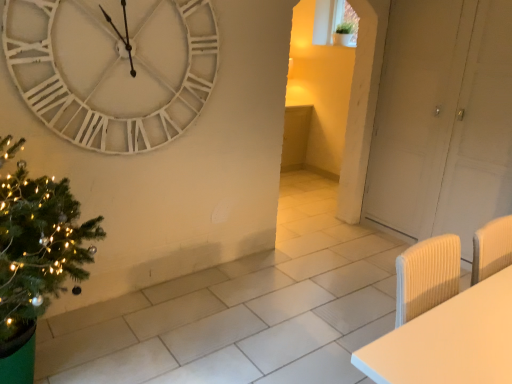
Question: Does white matte door at right have a lesser width compared to green textured christmas tree at left?

Choices:
 (A) yes
 (B) no

Answer: (A)

Question: Are white matte door at right and green textured christmas tree at left located far from each other?

Choices:
 (A) no
 (B) yes

Answer: (B)

Question: Considering the relative positions of white matte door at right and green textured christmas tree at left in the image provided, is white matte door at right behind green textured christmas tree at left?

Choices:
 (A) no
 (B) yes

Answer: (B)

Question: Is white matte door at right outside green textured christmas tree at left?

Choices:
 (A) yes
 (B) no

Answer: (A)

Question: From the image's perspective, is white matte door at right on green textured christmas tree at left?

Choices:
 (A) yes
 (B) no

Answer: (A)

Question: Which is correct: white matte door at right is inside green textured christmas tree at left, or outside of it?

Choices:
 (A) inside
 (B) outside

Answer: (B)

Question: In terms of width, does white matte door at right look wider or thinner when compared to green textured christmas tree at left?

Choices:
 (A) wide
 (B) thin

Answer: (B)

Question: From a real-world perspective, is white matte door at right positioned above or below green textured christmas tree at left?

Choices:
 (A) below
 (B) above

Answer: (B)

Question: In terms of height, does white matte door at right look taller or shorter compared to green textured christmas tree at left?

Choices:
 (A) short
 (B) tall

Answer: (B)

Question: In terms of height, does green textured christmas tree at left look taller or shorter compared to white wooden clock at upper left?

Choices:
 (A) short
 (B) tall

Answer: (B)

Question: Is green textured christmas tree at left in front of or behind white wooden clock at upper left in the image?

Choices:
 (A) behind
 (B) front

Answer: (B)

Question: Is green textured christmas tree at left situated inside white wooden clock at upper left or outside?

Choices:
 (A) inside
 (B) outside

Answer: (B)

Question: Is green textured christmas tree at left wider or thinner than white wooden clock at upper left?

Choices:
 (A) thin
 (B) wide

Answer: (B)

Question: Considering the positions of white wooden clock at upper left and white matte door at right in the image, is white wooden clock at upper left bigger or smaller than white matte door at right?

Choices:
 (A) small
 (B) big

Answer: (A)

Question: From the image's perspective, relative to white matte door at right, is white wooden clock at upper left above or below?

Choices:
 (A) above
 (B) below

Answer: (A)